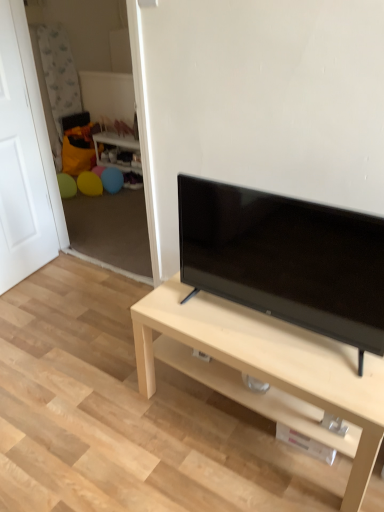
Question: Is wooden side table at center located outside white matte door at left?

Choices:
 (A) yes
 (B) no

Answer: (A)

Question: Is wooden side table at center further to the viewer compared to white matte door at left?

Choices:
 (A) no
 (B) yes

Answer: (B)

Question: Considering the relative sizes of wooden side table at center and white matte door at left in the image provided, is wooden side table at center taller than white matte door at left?

Choices:
 (A) yes
 (B) no

Answer: (B)

Question: Would you say white matte door at left is part of wooden side table at center's contents?

Choices:
 (A) yes
 (B) no

Answer: (B)

Question: Considering the relative sizes of wooden side table at center and white matte door at left in the image provided, is wooden side table at center wider than white matte door at left?

Choices:
 (A) yes
 (B) no

Answer: (A)

Question: Can you confirm if wooden side table at center is bigger than white matte door at left?

Choices:
 (A) no
 (B) yes

Answer: (A)

Question: Is light wood/finish tv stand at center looking in the opposite direction of white matte door at left?

Choices:
 (A) yes
 (B) no

Answer: (B)

Question: Is light wood/finish tv stand at center bigger than white matte door at left?

Choices:
 (A) yes
 (B) no

Answer: (A)

Question: Does light wood/finish tv stand at center have a lesser width compared to white matte door at left?

Choices:
 (A) yes
 (B) no

Answer: (B)

Question: Is light wood/finish tv stand at center aimed at white matte door at left?

Choices:
 (A) no
 (B) yes

Answer: (A)

Question: From the image's perspective, is light wood/finish tv stand at center over white matte door at left?

Choices:
 (A) no
 (B) yes

Answer: (A)

Question: Does light wood/finish tv stand at center have a greater width compared to white matte door at left?

Choices:
 (A) yes
 (B) no

Answer: (A)

Question: Is wooden side table at center located within light wood/finish tv stand at center?

Choices:
 (A) yes
 (B) no

Answer: (B)